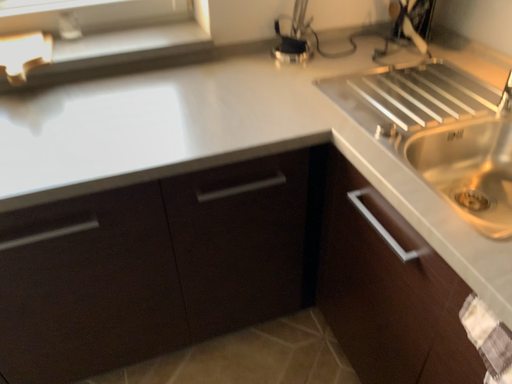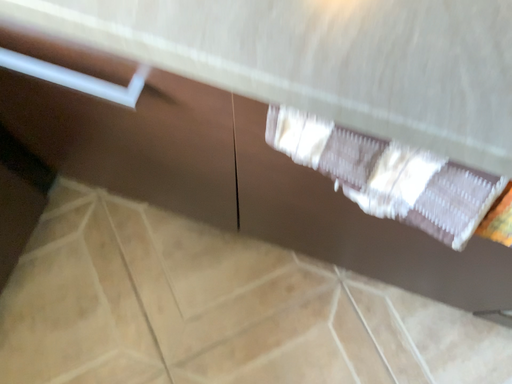
Question: Which way did the camera rotate in the video?

Choices:
 (A) rotated left
 (B) rotated right

Answer: (B)